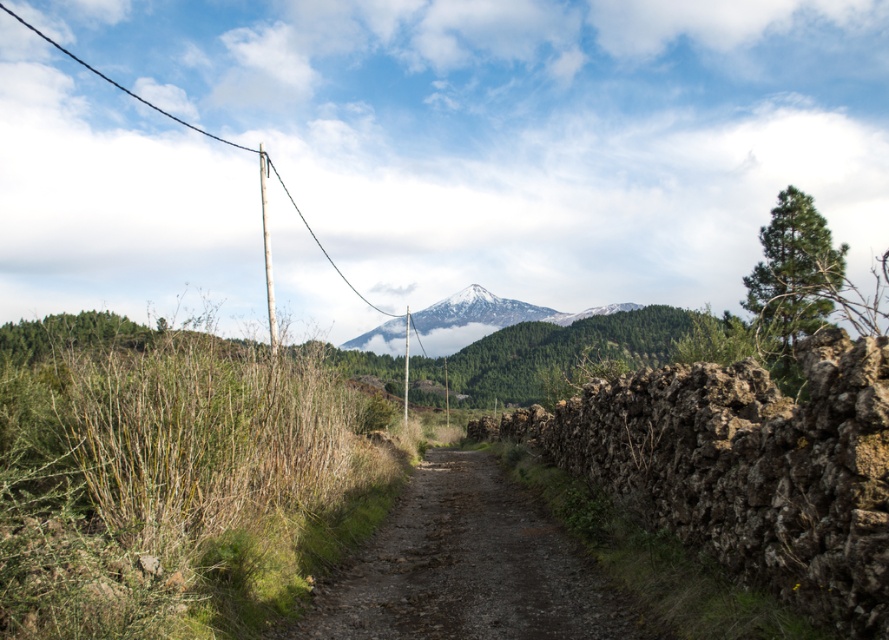
Question: Which point appears closest to the camera in this image?

Choices:
 (A) (381, 349)
 (B) (342, 604)

Answer: (B)

Question: Is dusty gravel path at center bigger than snow-covered mountain at center?

Choices:
 (A) no
 (B) yes

Answer: (A)

Question: Does dusty gravel path at center lie in front of snow-covered mountain at center?

Choices:
 (A) yes
 (B) no

Answer: (A)

Question: Which point is closer to the camera?

Choices:
 (A) dusty gravel path at center
 (B) snow-covered mountain at center

Answer: (A)

Question: Which point is farther to the camera?

Choices:
 (A) snow-covered mountain at center
 (B) dusty gravel path at center

Answer: (A)

Question: Is dusty gravel path at center in front of snow-covered mountain at center?

Choices:
 (A) no
 (B) yes

Answer: (B)